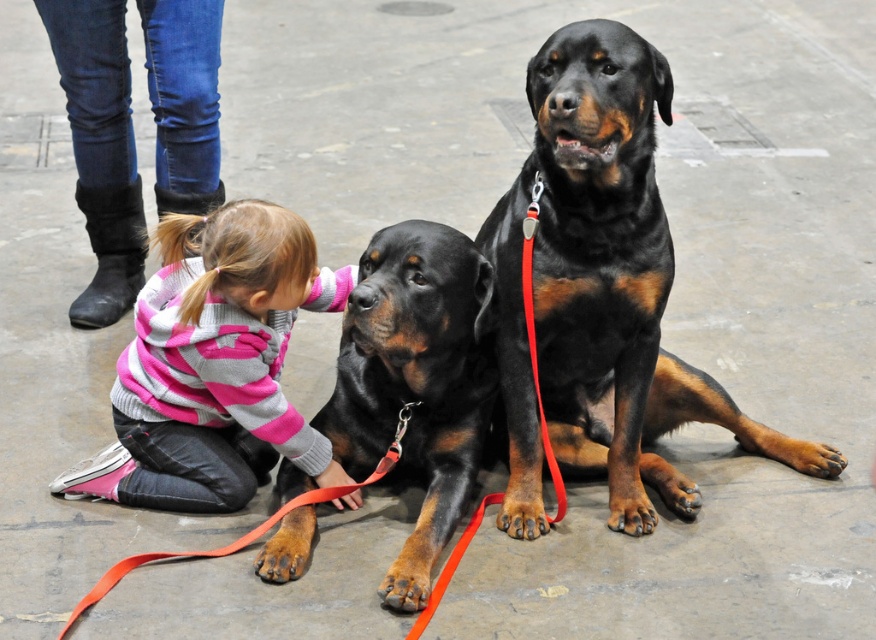
You are a photographer trying to capture a photo of the black glossy dog at center and the pink striped sweater at lower left. You want to ensure both subjects are fully visible in the frame. Based on their sizes, which subject should you focus on first to ensure they fit properly?

The black glossy dog at center is much taller than the pink striped sweater at lower left, so you should focus on positioning the camera to accommodate the larger size of the black glossy dog at center first to ensure both are fully visible.

You are a photographer trying to capture a photo of the black glossy dog at center and the pink striped sweater at lower left. From the photographer perspective, which object is on the right side?

The black glossy dog at center is positioned on the right side of the pink striped sweater at lower left.

Where is the black glossy dog at center located in the image?

The black glossy dog at center is located at point (601, 291).